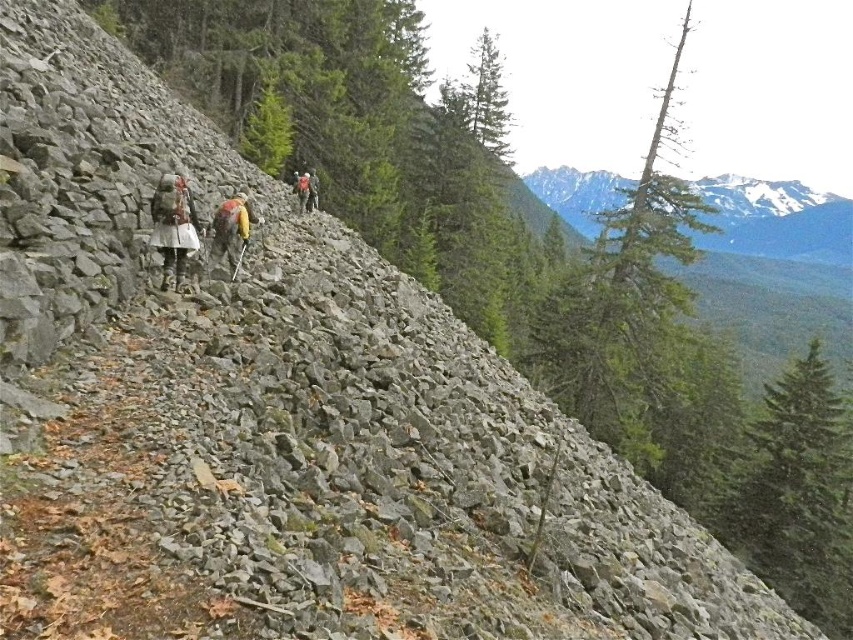
Which of these two, green textured tree at upper center or orange fabric backpack at center, stands shorter?

With less height is orange fabric backpack at center.

Is green textured tree at upper center closer to camera compared to orange fabric backpack at center?

Yes, it is in front of orange fabric backpack at center.

Is point (782, 452) positioned before point (310, 196)?

No, it is behind (310, 196).

Find the location of a particular element. green textured tree at upper center is located at coordinates (798, 493).

Does point (850, 244) come in front of point (163, 285)?

That is False.

Does snowy granite mountain at upper right have a lesser height compared to matte gray backpack at center?

Incorrect, snowy granite mountain at upper right's height does not fall short of matte gray backpack at center's.

Find the location of `snowy granite mountain at upper right`. snowy granite mountain at upper right is located at coordinates (775, 220).

In order to click on snowy granite mountain at upper right in this screenshot , I will do `click(775, 220)`.

Measure the distance from snowy granite mountain at upper right to green matte tree at center.

snowy granite mountain at upper right is 1122.50 feet away from green matte tree at center.

What do you see at coordinates (775, 220) in the screenshot? I see `snowy granite mountain at upper right` at bounding box center [775, 220].

Is point (612, 193) farther from camera compared to point (274, 156)?

Yes.

I want to click on snowy granite mountain at upper right, so click(775, 220).